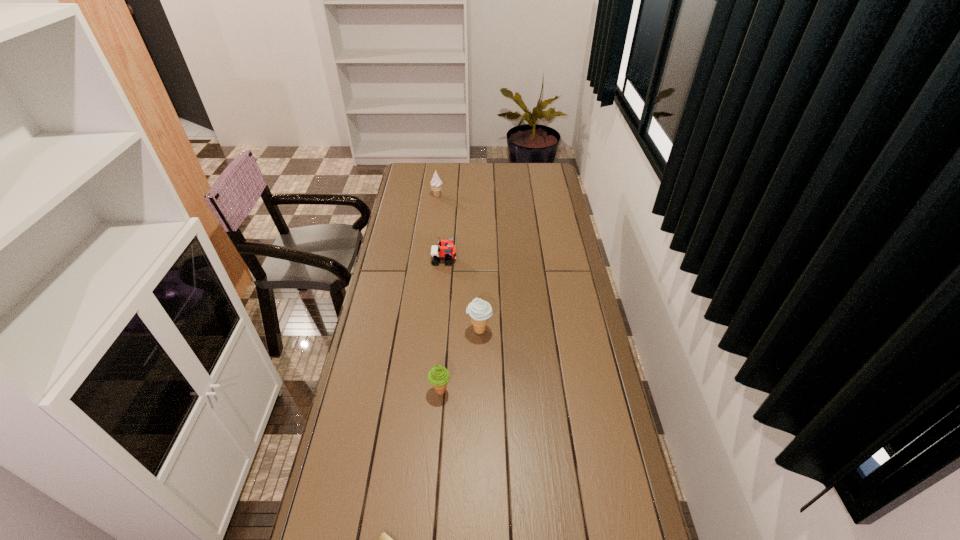
This screenshot has width=960, height=540. Identify the location of free space between the rightmost object and the second icecream from right to left. (460, 361).

This screenshot has height=540, width=960. I want to click on free space between the nearest icecream and the Lego, so click(x=443, y=325).

Image resolution: width=960 pixels, height=540 pixels. Identify the location of vacant point located between the rightmost object and the second icecream from left to right. (460, 361).

The width and height of the screenshot is (960, 540). I want to click on the second closest object to the second shortest object, so click(436, 184).

Identify the location of the closest object relative to the farthest icecream. The height and width of the screenshot is (540, 960). (447, 251).

Locate an element on the screen. Image resolution: width=960 pixels, height=540 pixels. the second closest icecream to the second farthest icecream is located at coordinates (436, 184).

Find the location of a particular element. The width and height of the screenshot is (960, 540). icecream that is the closest one to the farthest object is located at coordinates (480, 311).

Find the location of `vacant space that satisfies the following two spatial constraints: 1. on the back side of the second nearest icecream; 2. on the front-facing side of the leftmost icecream`. vacant space that satisfies the following two spatial constraints: 1. on the back side of the second nearest icecream; 2. on the front-facing side of the leftmost icecream is located at coordinates (480, 195).

Find the location of a particular element. The image size is (960, 540). free space in the image that satisfies the following two spatial constraints: 1. on the front-facing side of the second farthest object; 2. on the right side of the fourth farthest object is located at coordinates (433, 390).

The width and height of the screenshot is (960, 540). Find the location of `free point that satisfies the following two spatial constraints: 1. on the back side of the second farthest icecream; 2. on the front-facing side of the fourth nearest object`. free point that satisfies the following two spatial constraints: 1. on the back side of the second farthest icecream; 2. on the front-facing side of the fourth nearest object is located at coordinates (480, 260).